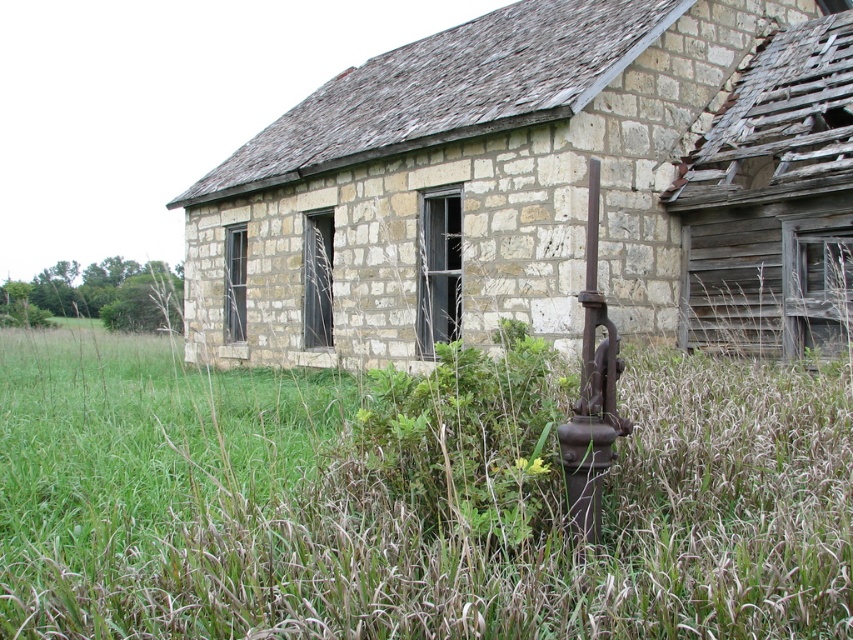
Is green grass at lower left further to the viewer compared to stone wall at center?

No.

Is point (28, 451) farther from camera compared to point (302, 304)?

No, (28, 451) is closer to viewer.

Which is in front, point (20, 593) or point (306, 237)?

Point (20, 593) is in front.

What are the coordinates of `green grass at lower left` in the screenshot? It's located at (412, 499).